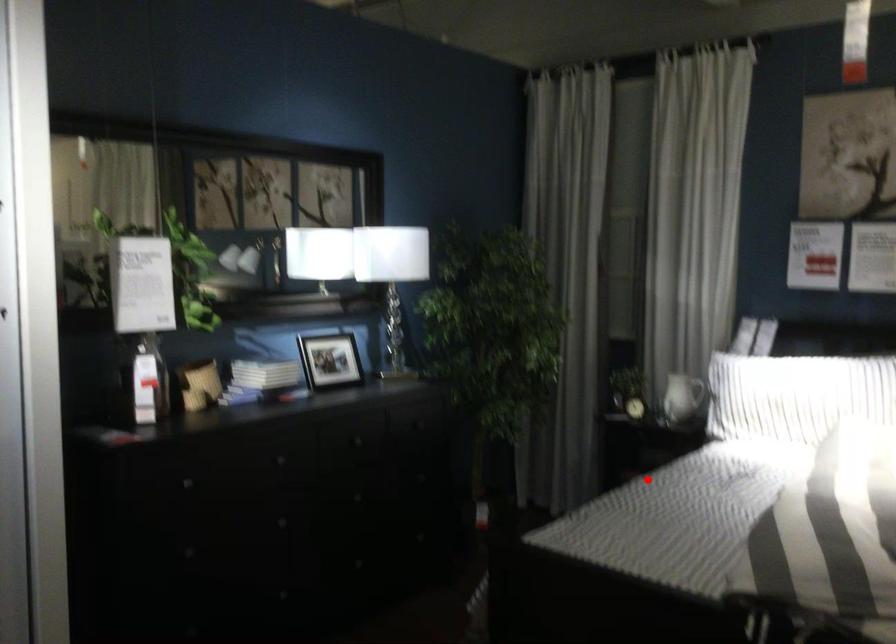
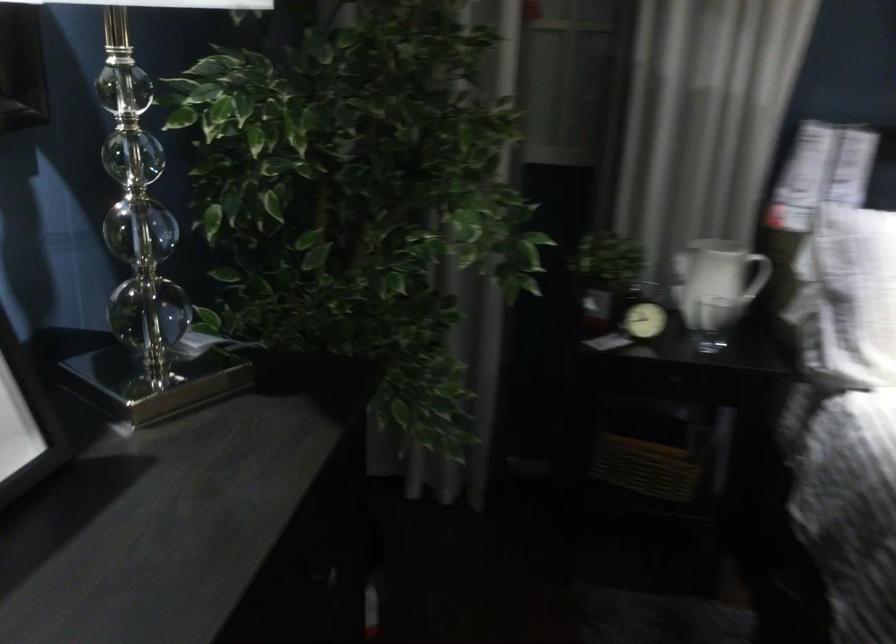
Where in the second image is the point corresponding to the highlighted location from the first image?

(645, 467)